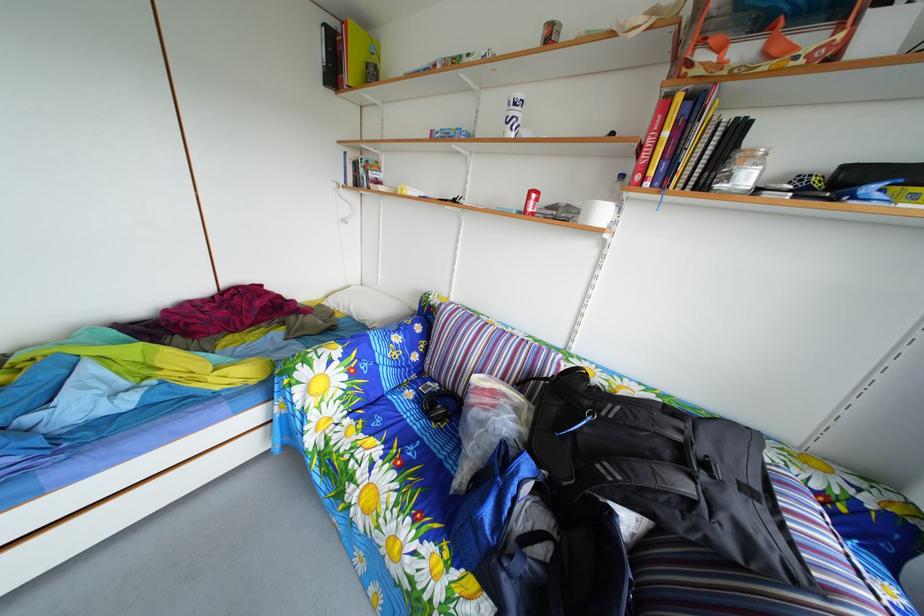
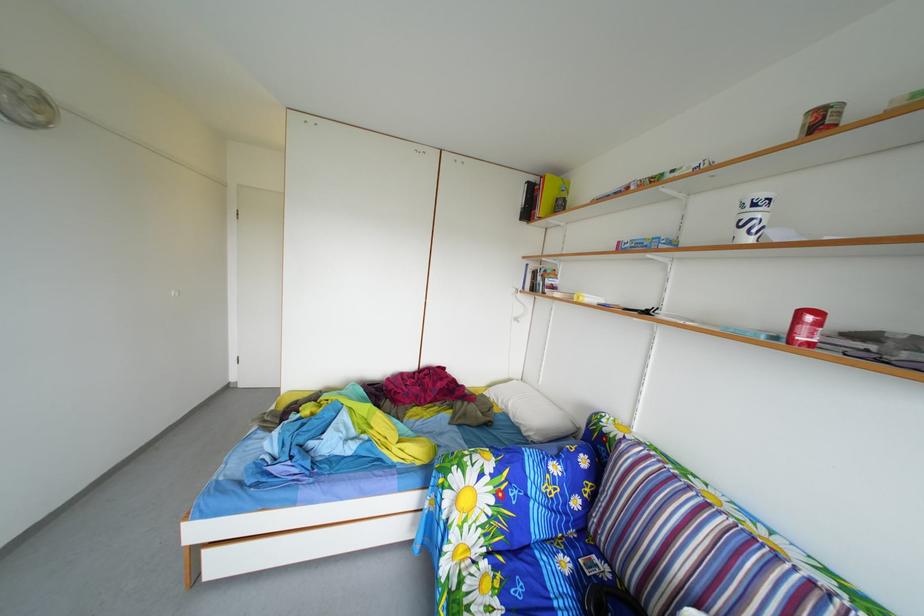
Where in the second image is the point corresponding to (526,111) from the first image?

(766, 214)